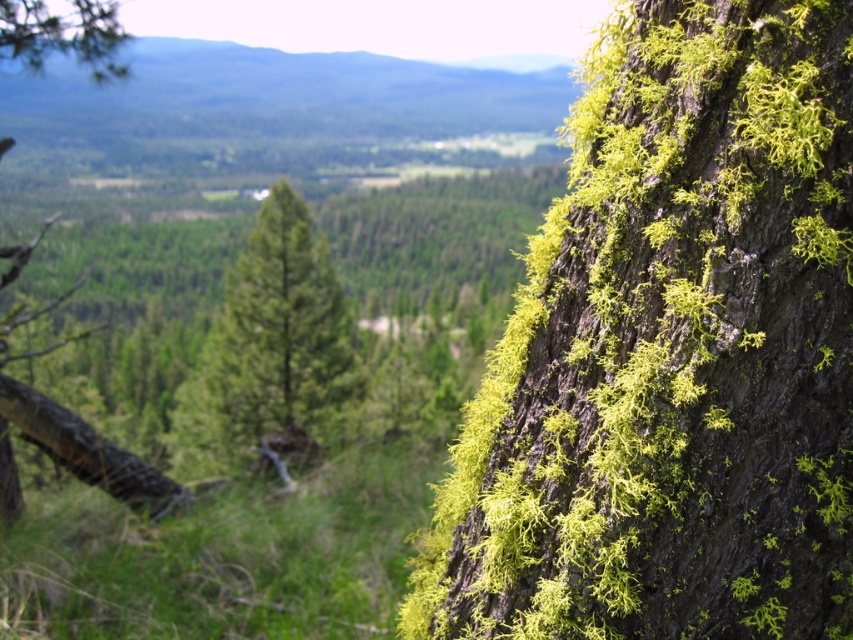
You are a hiker standing in the forest and see the green textured pine tree at center and the green mossy tree trunk at left. Which one is closer to you?

The green mossy tree trunk at left is closer to you because the green textured pine tree at center is positioned over it, indicating it is further away.

From the picture: You are a hiker who wants to take a photo of the green textured pine tree at center and the green mossy tree trunk at left. Which object should you focus on first if you want to capture both in the frame without moving your camera?

The green textured pine tree at center is wider than the green mossy tree trunk at left, so you should focus on the green textured pine tree at center first to ensure it fits in the frame, then adjust to include the smaller green mossy tree trunk at left.

You are standing in front of the tree trunk with the green moss. If you look at the point marked by coordinates point (671, 353), what would you see there?

At point (671, 353), you would see green mossy bark.